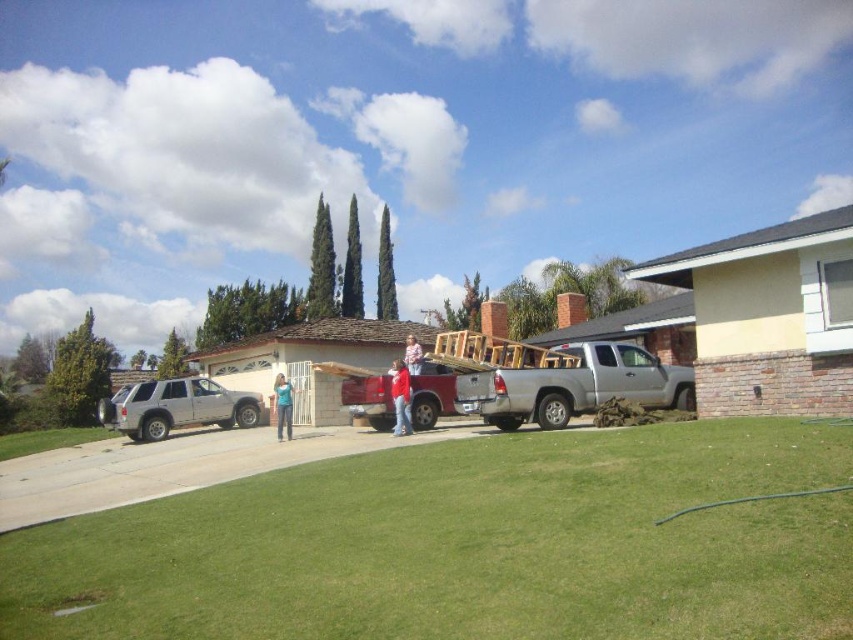
Who is more distant from viewer, (376, 442) or (288, 406)?

Point (288, 406)

Is gray concrete driveway at center to the right of blue denim jeans at center from the viewer's perspective?

No, gray concrete driveway at center is not to the right of blue denim jeans at center.

What are the coordinates of `gray concrete driveway at center` in the screenshot? It's located at (173, 467).

Is the position of red matte shirt at center less distant than that of denim jacket at center?

Yes, it is in front of denim jacket at center.

Does red matte shirt at center appear on the left side of denim jacket at center?

No, red matte shirt at center is not to the left of denim jacket at center.

Who is more forward, (x=405, y=428) or (x=407, y=349)?

Point (x=405, y=428) is more forward.

Locate an element on the screen. red matte shirt at center is located at coordinates click(399, 397).

In the scene shown: Is silver metallic pickup truck at center-right shorter than silver metallic suv at left?

Correct, silver metallic pickup truck at center-right is not as tall as silver metallic suv at left.

Between point (664, 396) and point (97, 412), which one is positioned in front?

Point (664, 396) is in front.

Locate an element on the screen. silver metallic pickup truck at center-right is located at coordinates (573, 385).